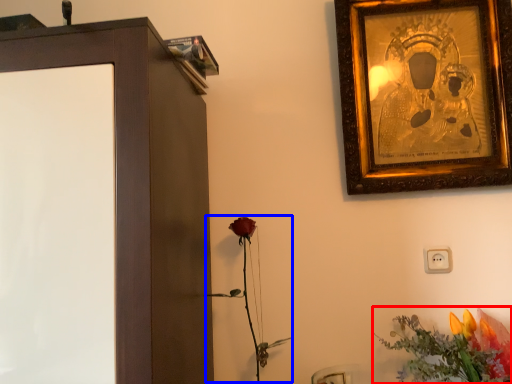
Question: Among these objects, which one is farthest to the camera, flower (highlighted by a red box) or plant (highlighted by a blue box)?

Choices:
 (A) flower
 (B) plant

Answer: (B)